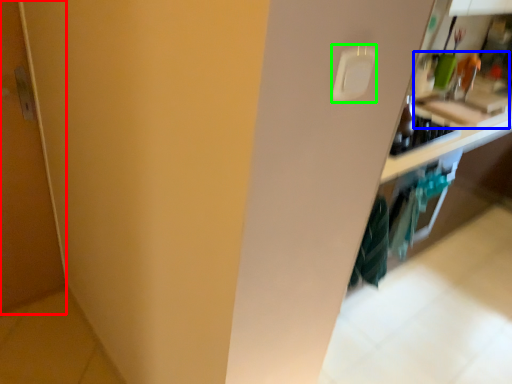
Question: Which object is positioned farthest from door (highlighted by a red box)? Select from sink (highlighted by a blue box) and light switch (highlighted by a green box).

Choices:
 (A) sink
 (B) light switch

Answer: (A)